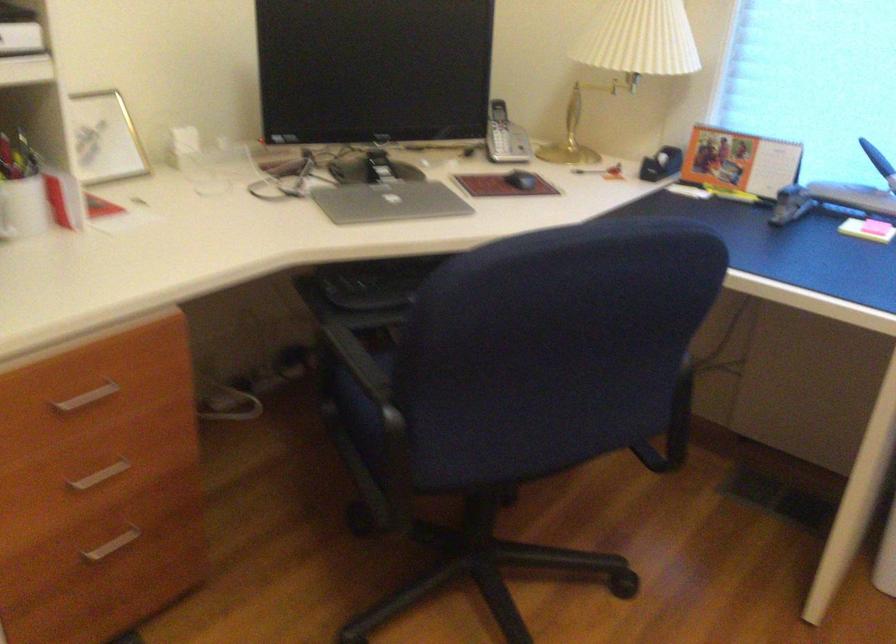
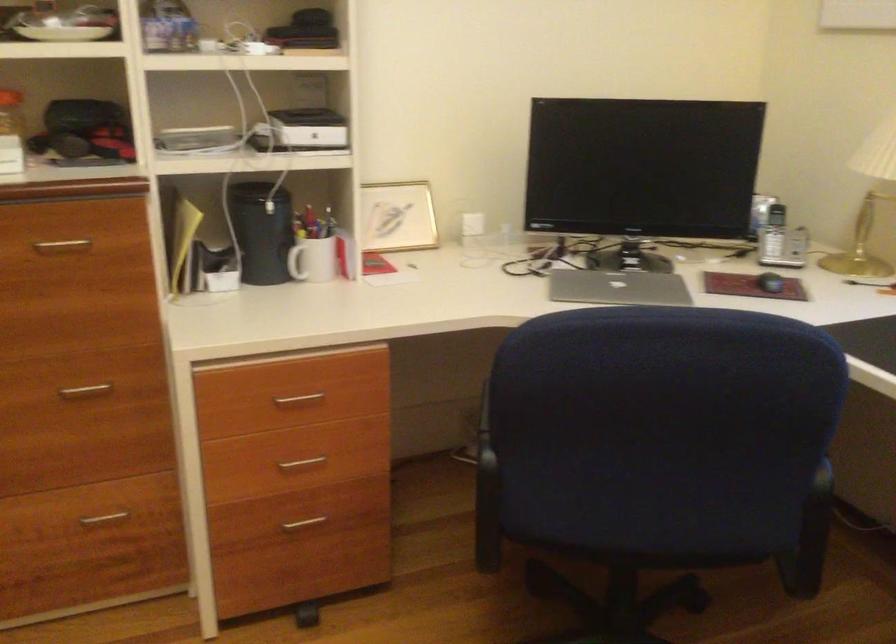
Question: The images are taken continuously from a first-person perspective. In which direction are you moving?

Choices:
 (A) Left
 (B) Right
 (C) Forward
 (D) Backward

Answer: (B)